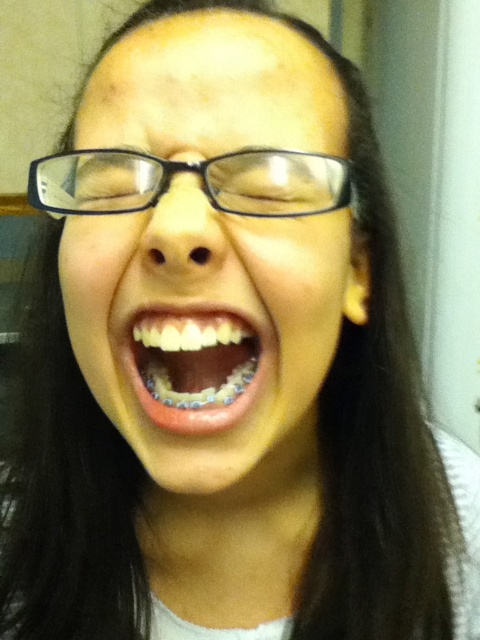
Question: Is clear plastic glasses at center wider than white glossy teeth at center?

Choices:
 (A) yes
 (B) no

Answer: (A)

Question: Does clear plastic glasses at center have a larger size compared to white glossy teeth at center?

Choices:
 (A) yes
 (B) no

Answer: (A)

Question: Which object appears farthest from the camera in this image?

Choices:
 (A) clear plastic glasses at center
 (B) white glossy teeth at center

Answer: (B)

Question: Considering the relative positions of clear plastic glasses at center and white glossy teeth at center in the image provided, where is clear plastic glasses at center located with respect to white glossy teeth at center?

Choices:
 (A) above
 (B) below

Answer: (A)

Question: Which object is closer to the camera taking this photo?

Choices:
 (A) clear plastic glasses at center
 (B) white glossy teeth at center

Answer: (A)